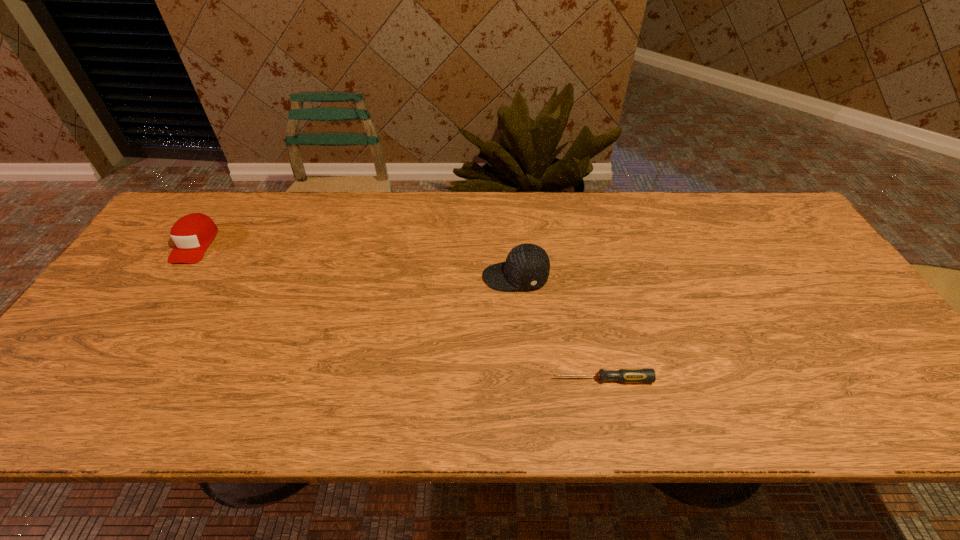
The image size is (960, 540). I want to click on vacant point located 0.280m insert the shortest object into a screw head, so click(426, 380).

Identify the location of vacant area situated 0.150m insert the shortest object into a screw head. The width and height of the screenshot is (960, 540). (485, 380).

I want to click on free spot located insert the shortest object into a screw head, so pos(453,380).

The height and width of the screenshot is (540, 960). I want to click on object present at the far edge, so click(192, 234).

Image resolution: width=960 pixels, height=540 pixels. Identify the location of object at the left edge. (192, 234).

Locate an element on the screen. object that is at the far left corner is located at coordinates pos(192,234).

Image resolution: width=960 pixels, height=540 pixels. Find the location of `vacant space at the far edge of the desktop`. vacant space at the far edge of the desktop is located at coordinates (389, 239).

Identify the location of vacant space at the near edge of the desktop. (740, 403).

Where is `free space at the left edge of the desktop`? Image resolution: width=960 pixels, height=540 pixels. free space at the left edge of the desktop is located at coordinates (114, 323).

In the image, there is a desktop. Where is `free space at the right edge`? The width and height of the screenshot is (960, 540). free space at the right edge is located at coordinates (858, 374).